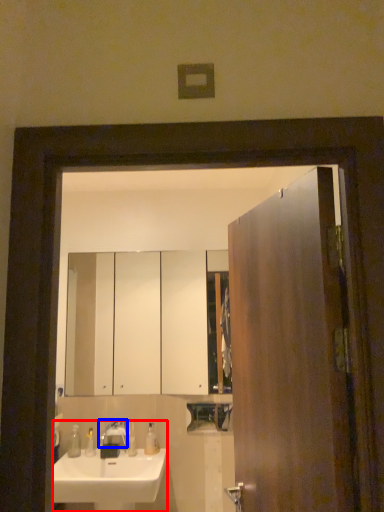
Question: Which object is closer to the camera taking this photo, sink (highlighted by a red box) or tap (highlighted by a blue box)?

Choices:
 (A) sink
 (B) tap

Answer: (A)